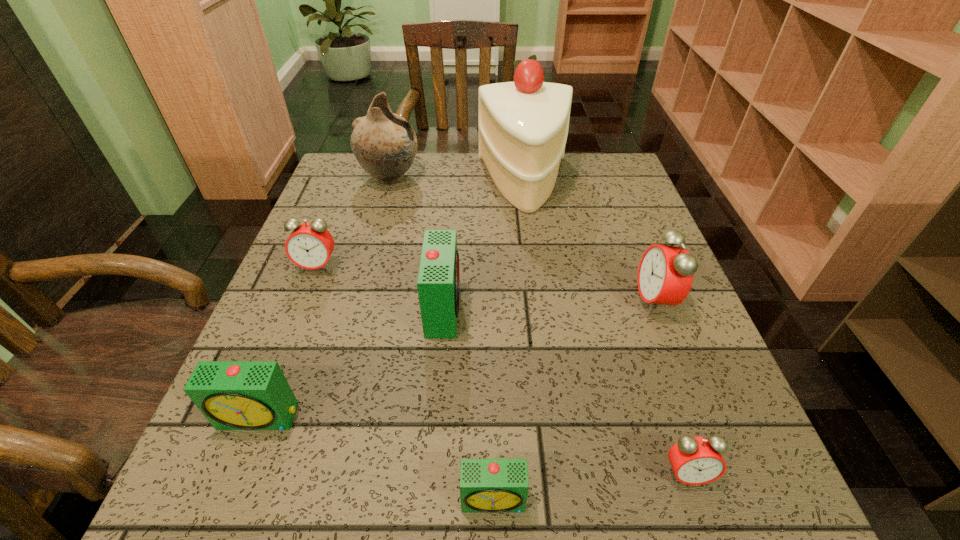
In the image, there is a desktop. At what (x,y) coordinates should I click in order to perform the action: click on blank space at the near left corner. Please return your answer as a coordinate pair (x, y). Looking at the image, I should click on 305,467.

You are a GUI agent. You are given a task and a screenshot of the screen. Output one action in this format:
    pyautogui.click(x=<x>, y=<y>)
    Task: Click on the vacant space at the far right corner of the desktop
    
    Given the screenshot: What is the action you would take?
    pyautogui.click(x=597, y=161)

Where is `blank space at the near right corner of the desktop`? blank space at the near right corner of the desktop is located at coordinates (720, 490).

You are a GUI agent. You are given a task and a screenshot of the screen. Output one action in this format:
    pyautogui.click(x=<x>, y=<y>)
    Task: Click on the blank region between the second smallest red alarm clock and the pottery
    
    Given the screenshot: What is the action you would take?
    pyautogui.click(x=353, y=222)

Locate an element on the screen. empty location between the nearest red alarm clock and the second smallest red alarm clock is located at coordinates (502, 370).

The height and width of the screenshot is (540, 960). I want to click on free space between the nearest red alarm clock and the second smallest red alarm clock, so (502, 370).

At what (x,y) coordinates should I click in order to perform the action: click on vacant area between the cake and the biggest red alarm clock. Please return your answer as a coordinate pair (x, y). Looking at the image, I should click on (589, 242).

Find the location of `vacant area that lies between the cake and the farthest alarm clock`. vacant area that lies between the cake and the farthest alarm clock is located at coordinates (421, 225).

Image resolution: width=960 pixels, height=540 pixels. Find the location of `free spot between the third nearest object and the cake`. free spot between the third nearest object and the cake is located at coordinates (392, 300).

The image size is (960, 540). Find the location of `vacant area that lies between the nearest red alarm clock and the third alarm clock from left to right`. vacant area that lies between the nearest red alarm clock and the third alarm clock from left to right is located at coordinates (564, 391).